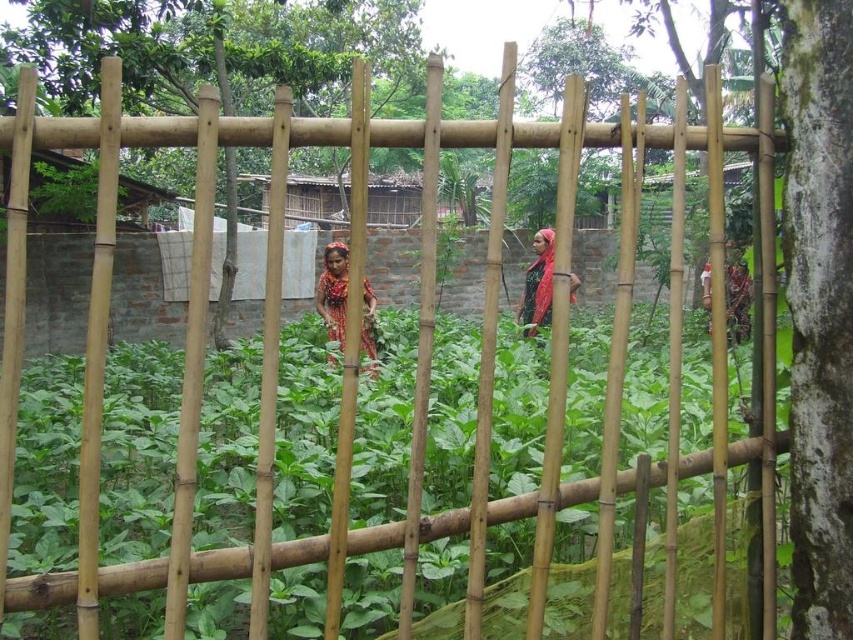
Question: Can you confirm if red fabric headscarf at center is bigger than matte green fabric at right?

Choices:
 (A) yes
 (B) no

Answer: (B)

Question: Is the position of printed fabric dress at center more distant than that of red fabric headscarf at center?

Choices:
 (A) no
 (B) yes

Answer: (A)

Question: Estimate the real-world distances between objects in this image. Which object is closer to the red fabric headscarf at center?

Choices:
 (A) printed fabric dress at center
 (B) matte green fabric at right

Answer: (A)

Question: Can you confirm if red fabric headscarf at center is positioned above matte green fabric at right?

Choices:
 (A) no
 (B) yes

Answer: (A)

Question: Based on their relative distances, which object is nearer to the printed fabric dress at center?

Choices:
 (A) matte green fabric at right
 (B) red fabric headscarf at center

Answer: (B)

Question: Which point is farther from the camera taking this photo?

Choices:
 (A) (368, 342)
 (B) (729, 256)

Answer: (B)